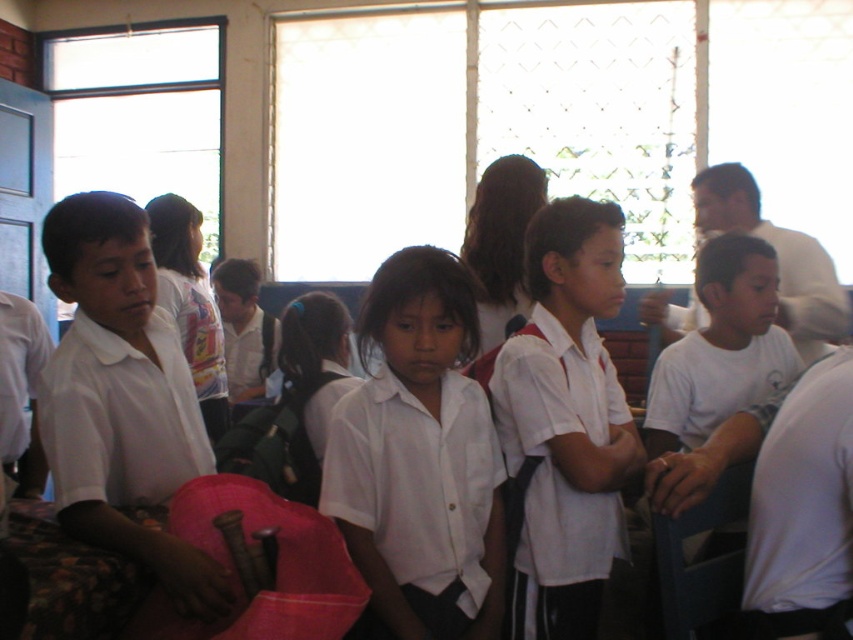
You are a photographer setting up for a group photo in this classroom. You notice the white matte uniform shirt at center and the matte white shirt at left. Which shirt should you focus on first to ensure both are in frame?

You should focus on the matte white shirt at left first because the white matte uniform shirt at center is located below it, ensuring both are in frame by starting from the top.

You are a photographer trying to capture a photo of the children in the classroom. You notice two children wearing white shirts. The first is wearing a white matte uniform shirt at center and the second is wearing a matte white shirt at left. Which child should you focus on first if you want to capture them from left to right order?

You should focus on the matte white shirt at left first because it is positioned to the left of the white matte uniform shirt at center.